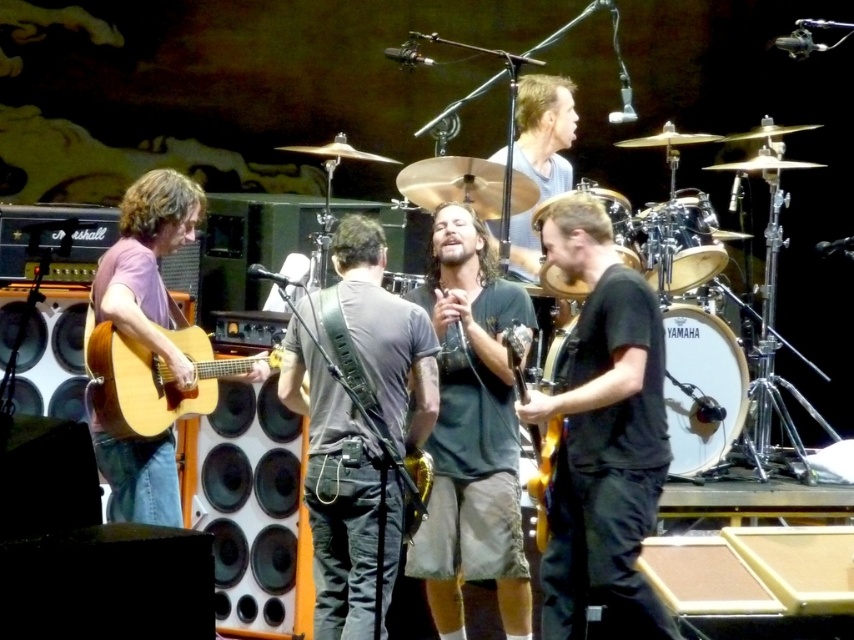
You are a stagehand setting up the venue and need to place a new amplifier. The amplifier must be positioned to the left of the yamaha drum at center. According to the stage layout, where should you place the amplifier?

The yamaha drum at center is located at point (700, 388), so the amplifier should be placed to the left of this coordinate.